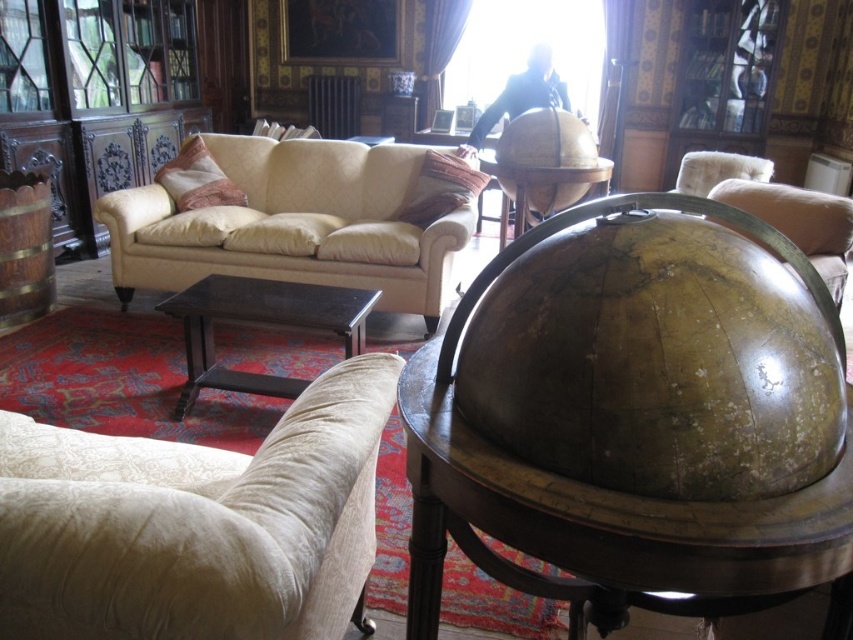
Question: Can you confirm if velvet beige armchair at lower left is positioned to the right of wooden globe at center?

Choices:
 (A) yes
 (B) no

Answer: (B)

Question: Which is nearer to the velvet beige pillow at center?

Choices:
 (A) velvet textured pillow at center
 (B) velvet beige armchair at lower left

Answer: (A)

Question: Which object is farther from the camera taking this photo?

Choices:
 (A) beige fabric couch at center
 (B) velvet beige armchair at lower left
 (C) velvet textured pillow at center

Answer: (C)

Question: Can you confirm if shiny brown globe at center is bigger than brown wooden table at center?

Choices:
 (A) no
 (B) yes

Answer: (B)

Question: Is beige fabric couch at center smaller than brown wooden table at center?

Choices:
 (A) yes
 (B) no

Answer: (B)

Question: Which object appears closest to the camera in this image?

Choices:
 (A) velvet textured pillow at center
 (B) velvet beige armchair at lower left

Answer: (B)